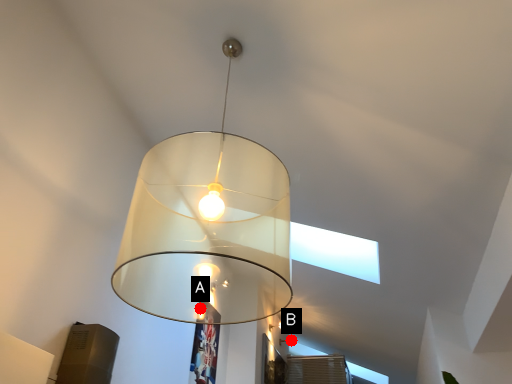
Question: Two points are circled on the image, labeled by A and B beside each circle. Which of the following is the closest to the observer?

Choices:
 (A) A is closer
 (B) B is closer

Answer: (A)